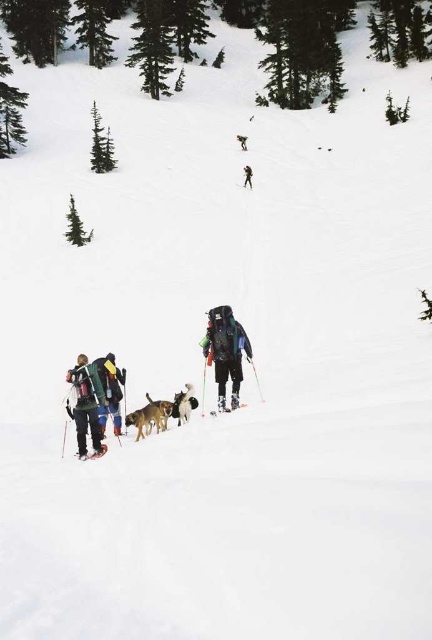
You are standing at the starting point of a mountain trail and see two markers labeled as point (247, 404) and point (248, 179). Which marker is closer to you?

Point (247, 404) is closer to the viewer than point (248, 179).

Looking at this image, you are a photographer trying to capture the brown fur dog at center in your shot. Based on its coordinates, where should you aim your camera?

The brown fur dog at center is located at coordinates point (149, 417), so aim your camera there.

You are a photographer trying to capture a clear photo of the green fabric backpack at upper center without the shiny metallic ski at lower left blocking it. Based on their sizes, is it possible to adjust your camera angle to avoid the ski overlapping with the backpack?

The shiny metallic ski at lower left is bigger than the green fabric backpack at upper center, so adjusting the camera angle might be challenging due to the ski being larger. However, since the backpack is positioned higher up at upper center, tilting the camera upwards could help avoid the ski overlapping with it.